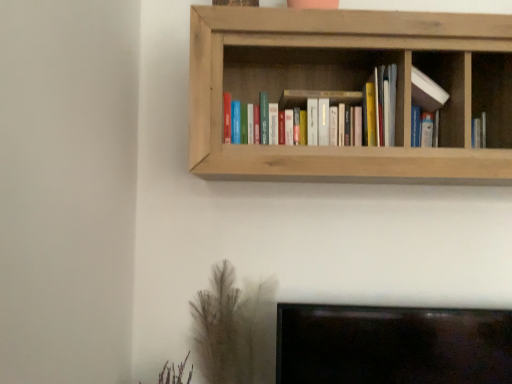
What is the approximate height of brown textured plant at lower left?

The height of brown textured plant at lower left is 11.38 inches.

This screenshot has width=512, height=384. What do you see at coordinates (351, 88) in the screenshot? I see `natural wood bookshelf at upper center` at bounding box center [351, 88].

I want to click on natural wood bookshelf at upper center, so coord(351,88).

This screenshot has width=512, height=384. What do you see at coordinates (448, 91) in the screenshot? I see `white matte bookshelf at upper center` at bounding box center [448, 91].

Where is `brown textured plant at lower left`? The height and width of the screenshot is (384, 512). brown textured plant at lower left is located at coordinates (234, 330).

From the image's perspective, would you say matte wooden bookshelf at center is positioned over brown textured plant at lower left?

Yes, from the image's perspective, matte wooden bookshelf at center is on top of brown textured plant at lower left.

Would you consider matte wooden bookshelf at center to be distant from brown textured plant at lower left?

matte wooden bookshelf at center is actually quite close to brown textured plant at lower left.

Can you confirm if matte wooden bookshelf at center is taller than brown textured plant at lower left?

Incorrect, the height of matte wooden bookshelf at center is not larger of that of brown textured plant at lower left.

Can you confirm if matte wooden bookshelf at center is thinner than brown textured plant at lower left?

Yes.

Which is closer, (286,96) or (448,61)?

The point (448,61) is closer.

Does matte wooden bookshelf at center lie behind white matte bookshelf at upper center?

No, it is not.

Is matte wooden bookshelf at center beside white matte bookshelf at upper center?

They are not placed beside each other.

Considering the sizes of matte wooden bookshelf at center and white matte bookshelf at upper center in the image, is matte wooden bookshelf at center bigger or smaller than white matte bookshelf at upper center?

matte wooden bookshelf at center is bigger than white matte bookshelf at upper center.

The width and height of the screenshot is (512, 384). Identify the location of plant below the natural wood bookshelf at upper center (from the image's perspective). (234, 330).

Does brown textured plant at lower left have a smaller size compared to natural wood bookshelf at upper center?

Yes.

What's the angular difference between brown textured plant at lower left and natural wood bookshelf at upper center's facing directions?

The facing directions of brown textured plant at lower left and natural wood bookshelf at upper center are 1.84 degrees apart.

Looking at their sizes, would you say brown textured plant at lower left is wider or thinner than natural wood bookshelf at upper center?

brown textured plant at lower left is thinner than natural wood bookshelf at upper center.

Is white matte bookshelf at upper center touching brown textured plant at lower left?

white matte bookshelf at upper center and brown textured plant at lower left are not in contact.

Which of these two, white matte bookshelf at upper center or brown textured plant at lower left, is thinner?

With smaller width is white matte bookshelf at upper center.

Is white matte bookshelf at upper center shorter than natural wood bookshelf at upper center?

Correct, white matte bookshelf at upper center is not as tall as natural wood bookshelf at upper center.

Is the surface of white matte bookshelf at upper center in direct contact with natural wood bookshelf at upper center?

Result: white matte bookshelf at upper center is not next to natural wood bookshelf at upper center, and they're not touching.

From the image's perspective, is white matte bookshelf at upper center located above or below natural wood bookshelf at upper center?

white matte bookshelf at upper center is situated lower than natural wood bookshelf at upper center in the image.

Looking at this image, is white matte bookshelf at upper center turned away from natural wood bookshelf at upper center?

Yes, white matte bookshelf at upper center is facing away from natural wood bookshelf at upper center.

Could you tell me if natural wood bookshelf at upper center is turned towards matte wooden bookshelf at center?

Yes.

How far apart are natural wood bookshelf at upper center and matte wooden bookshelf at center?

A distance of 4.13 inches exists between natural wood bookshelf at upper center and matte wooden bookshelf at center.

From the image's perspective, which is below, natural wood bookshelf at upper center or matte wooden bookshelf at center?

matte wooden bookshelf at center, from the image's perspective.

From a real-world perspective, is natural wood bookshelf at upper center on top of matte wooden bookshelf at center?

Yes, from a real-world perspective, natural wood bookshelf at upper center is above matte wooden bookshelf at center.

Who is taller, matte wooden bookshelf at center or natural wood bookshelf at upper center?

natural wood bookshelf at upper center.

Is matte wooden bookshelf at center wider than natural wood bookshelf at upper center?

In fact, matte wooden bookshelf at center might be narrower than natural wood bookshelf at upper center.

From the image's perspective, is matte wooden bookshelf at center on top of natural wood bookshelf at upper center?

No, from the image's perspective, matte wooden bookshelf at center is not above natural wood bookshelf at upper center.

From a real-world perspective, is matte wooden bookshelf at center physically below natural wood bookshelf at upper center?

Yes.

At what (x,y) coordinates should I click in order to perform the action: click on plant lying behind the matte wooden bookshelf at center. Please return your answer as a coordinate pair (x, y). Looking at the image, I should click on (234, 330).

This screenshot has height=384, width=512. In the image, there is a white matte bookshelf at upper center. What are the coordinates of `book above it (from the image's perspective)` in the screenshot? It's located at (317, 88).

When comparing their distances from brown textured plant at lower left, does white matte bookshelf at upper center or natural wood bookshelf at upper center seem closer?

The object closer to brown textured plant at lower left is natural wood bookshelf at upper center.

Consider the image. Looking at the image, which one is located closer to matte wooden bookshelf at center, brown textured plant at lower left or natural wood bookshelf at upper center?

natural wood bookshelf at upper center is closer to matte wooden bookshelf at center.

Consider the image. From the image, which object appears to be farther from matte wooden bookshelf at center, white matte bookshelf at upper center or natural wood bookshelf at upper center?

The object further to matte wooden bookshelf at center is white matte bookshelf at upper center.

Based on their spatial positions, is brown textured plant at lower left or white matte bookshelf at upper center closer to natural wood bookshelf at upper center?

white matte bookshelf at upper center is closer to natural wood bookshelf at upper center.

Estimate the real-world distances between objects in this image. Which object is closer to brown textured plant at lower left, natural wood bookshelf at upper center or white matte bookshelf at upper center?

Among the two, natural wood bookshelf at upper center is located nearer to brown textured plant at lower left.

Based on their spatial positions, is matte wooden bookshelf at center or natural wood bookshelf at upper center closer to white matte bookshelf at upper center?

The object closer to white matte bookshelf at upper center is matte wooden bookshelf at center.

In the scene shown: When comparing their distances from natural wood bookshelf at upper center, does matte wooden bookshelf at center or white matte bookshelf at upper center seem closer?

matte wooden bookshelf at center is closer to natural wood bookshelf at upper center.

Looking at the image, which one is located closer to brown textured plant at lower left, white matte bookshelf at upper center or matte wooden bookshelf at center?

matte wooden bookshelf at center lies closer to brown textured plant at lower left than the other object.

Locate an element on the screen. The image size is (512, 384). shelf between matte wooden bookshelf at center and white matte bookshelf at upper center is located at coordinates (351, 88).

Where is `cabinet between matte wooden bookshelf at center and brown textured plant at lower left in the vertical direction`? This screenshot has height=384, width=512. cabinet between matte wooden bookshelf at center and brown textured plant at lower left in the vertical direction is located at coordinates (448, 91).

The width and height of the screenshot is (512, 384). Find the location of `book between natural wood bookshelf at upper center and brown textured plant at lower left vertically`. book between natural wood bookshelf at upper center and brown textured plant at lower left vertically is located at coordinates (317, 88).

Locate an element on the screen. The width and height of the screenshot is (512, 384). cabinet between natural wood bookshelf at upper center and brown textured plant at lower left in the up-down direction is located at coordinates (448, 91).